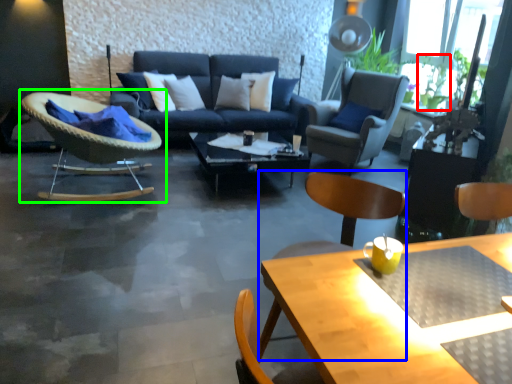
Question: Estimate the real-world distances between objects in this image. Which object is closer to plant (highlighted by a red box), beach chair (highlighted by a blue box) or chair (highlighted by a green box)?

Choices:
 (A) beach chair
 (B) chair

Answer: (A)